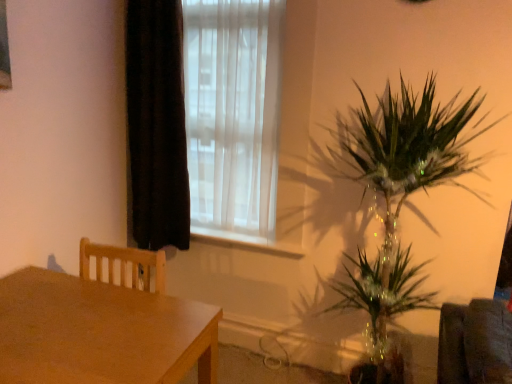
Where is `vacant location below white sheer curtain at upper center (from a real-world perspective)`? vacant location below white sheer curtain at upper center (from a real-world perspective) is located at coordinates (220, 230).